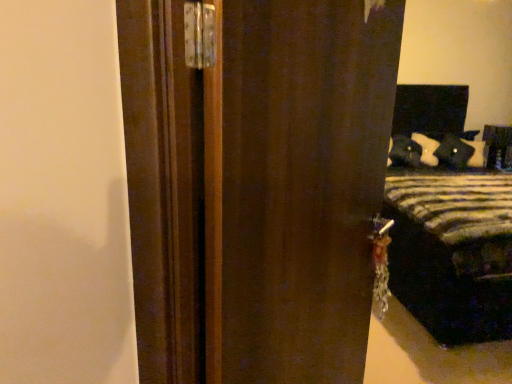
What do you see at coordinates (497, 145) in the screenshot? I see `matte black pillow at upper right` at bounding box center [497, 145].

What are the coordinates of `dark wood door at center` in the screenshot? It's located at (256, 187).

Is velvet black pillow at right outside of matte black pillow at upper right?

Yes, velvet black pillow at right is located beyond the bounds of matte black pillow at upper right.

Looking at this image, from the image's perspective, which object appears higher, velvet black pillow at right or matte black pillow at upper right?

From the image's view, matte black pillow at upper right is above.

Locate an element on the screen. The image size is (512, 384). pillow on the left of matte black pillow at upper right is located at coordinates (453, 152).

Are velvet black pillow at right and matte black pillow at upper right making contact?

No.

Which is behind, point (402, 184) or point (257, 330)?

The point (402, 184) is farther.

How distant is striped fabric bed at right from dark wood door at center?

5.34 feet.

Is striped fabric bed at right wider or thinner than dark wood door at center?

In the image, striped fabric bed at right appears to be wider than dark wood door at center.

Can you confirm if striped fabric bed at right is bigger than velvet black pillow at right?

Yes, striped fabric bed at right is bigger than velvet black pillow at right.

From the image's perspective, which is below, striped fabric bed at right or velvet black pillow at right?

striped fabric bed at right is shown below in the image.

Could you tell me if striped fabric bed at right is facing velvet black pillow at right?

No, striped fabric bed at right is not oriented towards velvet black pillow at right.

Does point (442, 120) come closer to viewer compared to point (453, 160)?

That is False.

Is striped fabric bed at right turned away from matte black pillow at upper right?

No.

Who is bigger, striped fabric bed at right or matte black pillow at upper right?

With larger size is striped fabric bed at right.

Which is correct: striped fabric bed at right is inside matte black pillow at upper right, or outside of it?

The correct answer is: outside.

Looking at this image, is striped fabric bed at right far from matte black pillow at upper right?

striped fabric bed at right is far away from matte black pillow at upper right.

Considering the points (247, 4) and (455, 164), which point is in front, point (247, 4) or point (455, 164)?

The point (247, 4) is in front.

Is dark wood door at center positioned far away from velvet black pillow at right?

Yes.

Is dark wood door at center turned away from velvet black pillow at right?

dark wood door at center is not turned away from velvet black pillow at right.

Which of these two, dark wood door at center or velvet black pillow at right, is bigger?

dark wood door at center.

You are a GUI agent. You are given a task and a screenshot of the screen. Output one action in this format:
    pyautogui.click(x=<x>, y=<y>)
    Task: Click on the furniture located behind the velvet black pillow at right
    The width and height of the screenshot is (512, 384).
    Given the screenshot: What is the action you would take?
    pyautogui.click(x=497, y=145)

Is point (490, 145) behind point (454, 145)?

No, (490, 145) is in front of (454, 145).

Which of these two, matte black pillow at upper right or velvet black pillow at right, is smaller?

With smaller size is matte black pillow at upper right.

Is matte black pillow at upper right taller than velvet black pillow at right?

Indeed, matte black pillow at upper right has a greater height compared to velvet black pillow at right.

From a real-world perspective, which is physically below, dark wood door at center or matte black pillow at upper right?

From a 3D spatial view, matte black pillow at upper right is below.

Is dark wood door at center facing towards matte black pillow at upper right?

No, dark wood door at center is not aimed at matte black pillow at upper right.

Where is `door lying below the matte black pillow at upper right (from the image's perspective)`? This screenshot has height=384, width=512. door lying below the matte black pillow at upper right (from the image's perspective) is located at coordinates (256, 187).

Does point (368, 222) come farther from viewer compared to point (488, 163)?

No, (368, 222) is in front of (488, 163).

The image size is (512, 384). What are the coordinates of `furniture above the velvet black pillow at right (from the image's perspective)` in the screenshot? It's located at (497, 145).

This screenshot has width=512, height=384. I want to click on door in front of the striped fabric bed at right, so click(256, 187).

Considering their positions, is velvet black pillow at right positioned closer to matte black pillow at upper right than dark wood door at center?

velvet black pillow at right.

Considering their positions, is dark wood door at center positioned further to striped fabric bed at right than matte black pillow at upper right?

dark wood door at center lies further to striped fabric bed at right than the other object.

Based on the photo, looking at the image, which one is located closer to dark wood door at center, matte black pillow at upper right or velvet black pillow at right?

The object closer to dark wood door at center is velvet black pillow at right.

In the scene shown: Looking at the image, which one is located closer to matte black pillow at upper right, velvet black pillow at right or striped fabric bed at right?

Among the two, velvet black pillow at right is located nearer to matte black pillow at upper right.

From the image, which object appears to be nearer to dark wood door at center, striped fabric bed at right or matte black pillow at upper right?

striped fabric bed at right is positioned closer to the anchor dark wood door at center.

When comparing their distances from matte black pillow at upper right, does striped fabric bed at right or dark wood door at center seem closer?

Based on the image, striped fabric bed at right appears to be nearer to matte black pillow at upper right.

Looking at the image, which one is located further to velvet black pillow at right, dark wood door at center or matte black pillow at upper right?

Based on the image, dark wood door at center appears to be further to velvet black pillow at right.

Based on their spatial positions, is velvet black pillow at right or matte black pillow at upper right closer to dark wood door at center?

Based on the image, velvet black pillow at right appears to be nearer to dark wood door at center.

At what (x,y) coordinates should I click in order to perform the action: click on bed between dark wood door at center and velvet black pillow at right in the front-back direction. Please return your answer as a coordinate pair (x, y). The width and height of the screenshot is (512, 384). Looking at the image, I should click on (447, 223).

Locate an element on the screen. pillow located between striped fabric bed at right and matte black pillow at upper right in the depth direction is located at coordinates (453, 152).

At what (x,y) coordinates should I click in order to perform the action: click on bed between dark wood door at center and matte black pillow at upper right along the z-axis. Please return your answer as a coordinate pair (x, y). The image size is (512, 384). Looking at the image, I should click on (447, 223).

You are a GUI agent. You are given a task and a screenshot of the screen. Output one action in this format:
    pyautogui.click(x=<x>, y=<y>)
    Task: Click on the pillow between dark wood door at center and matte black pillow at upper right along the z-axis
    
    Given the screenshot: What is the action you would take?
    pyautogui.click(x=453, y=152)